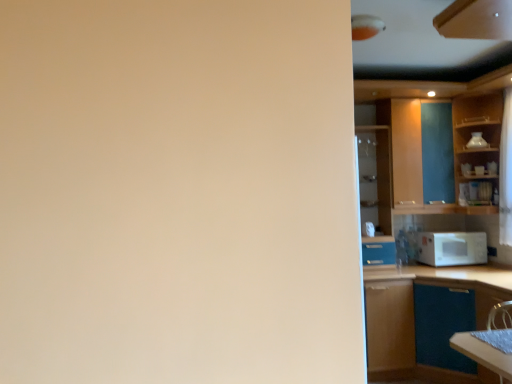
Question: Relative to wooden cabinet at upper right, which is the first cabinetry from front to back, is brown matte cabinet at right, the 3th cabinetry positioned from the front, in front or behind?

Choices:
 (A) front
 (B) behind

Answer: (B)

Question: Is point (374, 344) positioned closer to the camera than point (487, 13)?

Choices:
 (A) farther
 (B) closer

Answer: (A)

Question: Which of these objects is positioned closest to the white matte microwave at right?

Choices:
 (A) white sheer curtain at right
 (B) matte glass cabinet at right, arranged as the first cabinetry when viewed from the back
 (C) brown matte cabinet at right, placed as the third cabinetry when sorted from back to front
 (D) wooden cabinet at right, which appears as the second cabinetry when viewed from the back
 (E) white matte cabinet at right, which ranks as the 4th cabinetry in back-to-front order

Answer: (E)

Question: Estimate the real-world distances between objects in this image. Which object is closer to the white matte cabinet at right, which ranks as the 4th cabinetry in back-to-front order?

Choices:
 (A) wooden cabinet at upper right, which is the first cabinetry from front to back
 (B) matte glass cabinet at right, arranged as the 5th cabinetry when viewed from the front
 (C) wooden cabinet at right, marked as the fourth cabinetry in a front-to-back arrangement
 (D) white sheer curtain at right
 (E) white matte microwave at right

Answer: (E)